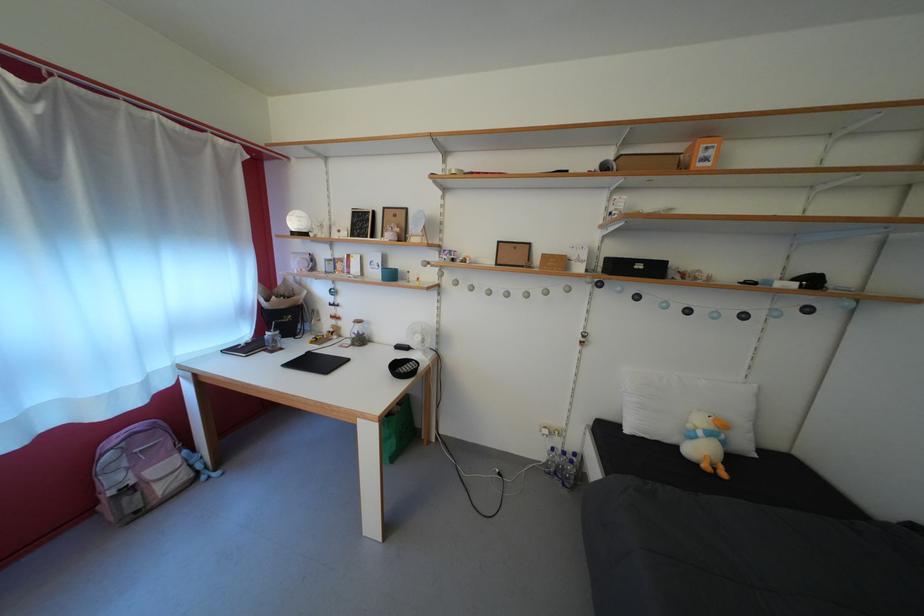
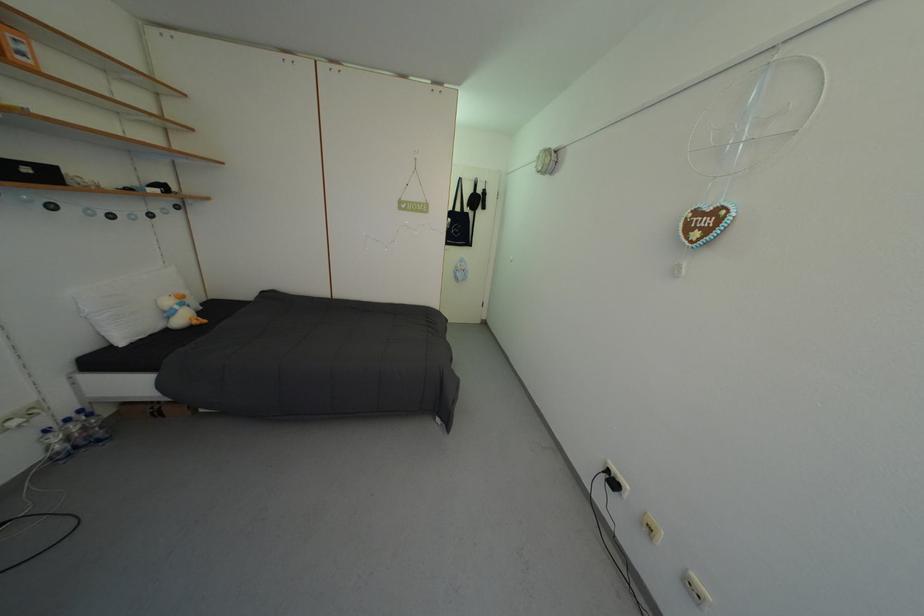
In the second image, find the point that corresponds to the point at 562,455 in the first image.

(55, 437)